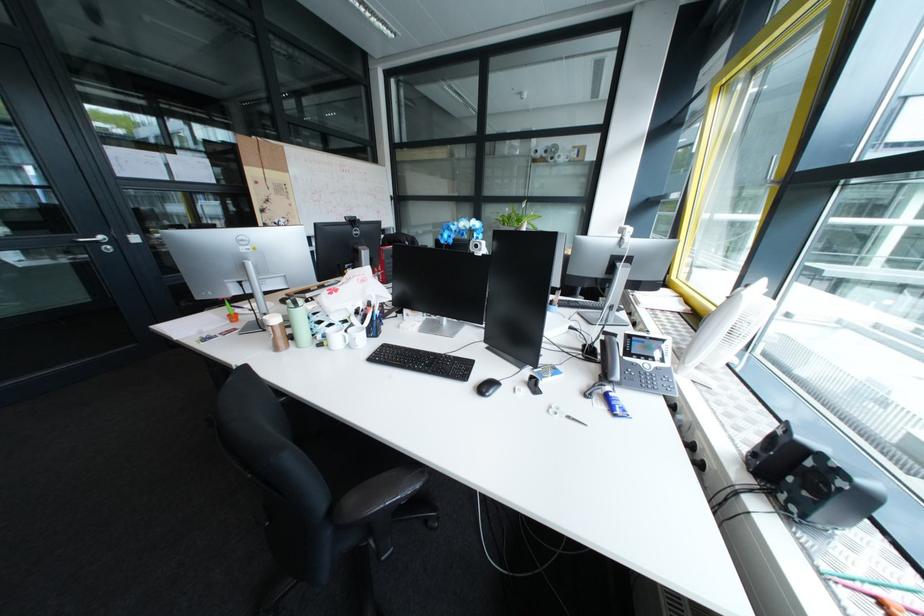
This screenshot has height=616, width=924. I want to click on black chair armrest, so click(379, 493).